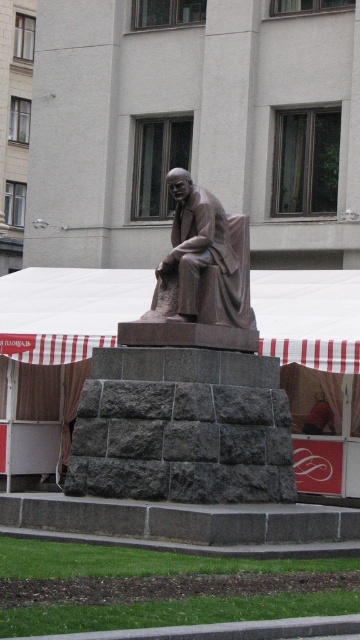
Question: Can you confirm if white striped canopy at center is bigger than bronze/statue at center?

Choices:
 (A) yes
 (B) no

Answer: (A)

Question: Which is nearer to the bronze/statue at center?

Choices:
 (A) bronze statue at center
 (B) white striped canopy at center

Answer: (A)

Question: Which of these objects is positioned closest to the white striped canopy at center?

Choices:
 (A) bronze statue at center
 (B) bronze/statue at center

Answer: (A)

Question: Is bronze statue at center wider than bronze/statue at center?

Choices:
 (A) yes
 (B) no

Answer: (A)

Question: Which point is farther to the camera?

Choices:
 (A) (213, 312)
 (B) (38, 324)

Answer: (B)

Question: Does bronze statue at center have a smaller size compared to white striped canopy at center?

Choices:
 (A) no
 (B) yes

Answer: (B)